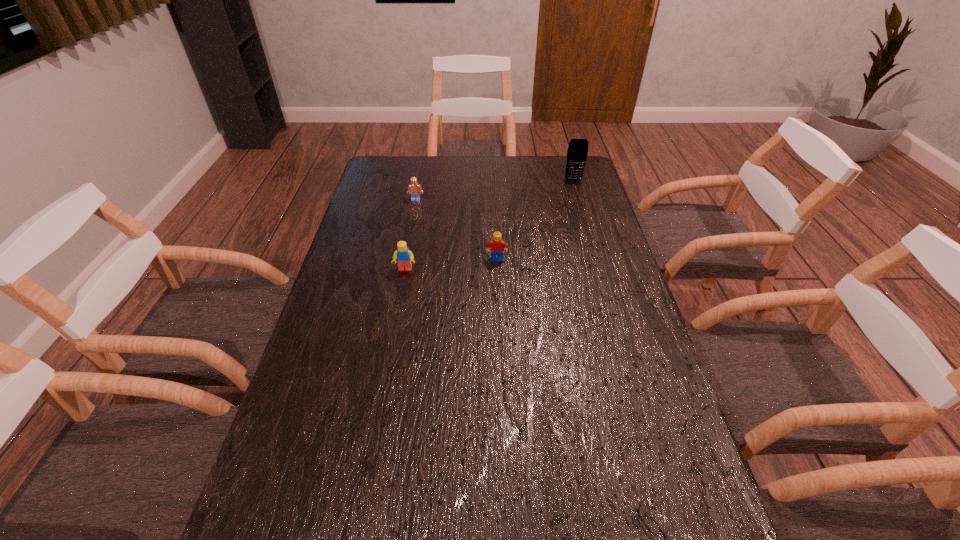
Identify the location of the farthest object. Image resolution: width=960 pixels, height=540 pixels. (577, 152).

Find the location of `cellular telephone`. cellular telephone is located at coordinates (577, 152).

The height and width of the screenshot is (540, 960). I want to click on the rightmost Lego, so click(x=496, y=245).

I want to click on the third object from right to left, so click(x=496, y=245).

Locate an element on the screen. the second nearest object is located at coordinates (403, 256).

Where is `the fourth nearest object`? the fourth nearest object is located at coordinates (415, 189).

Find the location of a particular element. The width and height of the screenshot is (960, 540). free location located on the screen of the tallest object is located at coordinates (580, 200).

You are a GUI agent. You are given a task and a screenshot of the screen. Output one action in this format:
    pyautogui.click(x=<x>, y=<y>)
    Task: Click on the blank space located on the face of the rightmost Lego
    The width and height of the screenshot is (960, 540).
    Given the screenshot: What is the action you would take?
    pyautogui.click(x=500, y=348)

I want to click on vacant space located 0.390m on the front-facing side of the fourth farthest object, so click(384, 384).

You are a GUI agent. You are given a task and a screenshot of the screen. Output one action in this format:
    pyautogui.click(x=<x>, y=<y>)
    Task: Click on the vacant space situated 0.210m on the front-facing side of the farthest Lego
    The image size is (960, 540).
    Given the screenshot: What is the action you would take?
    pyautogui.click(x=409, y=237)